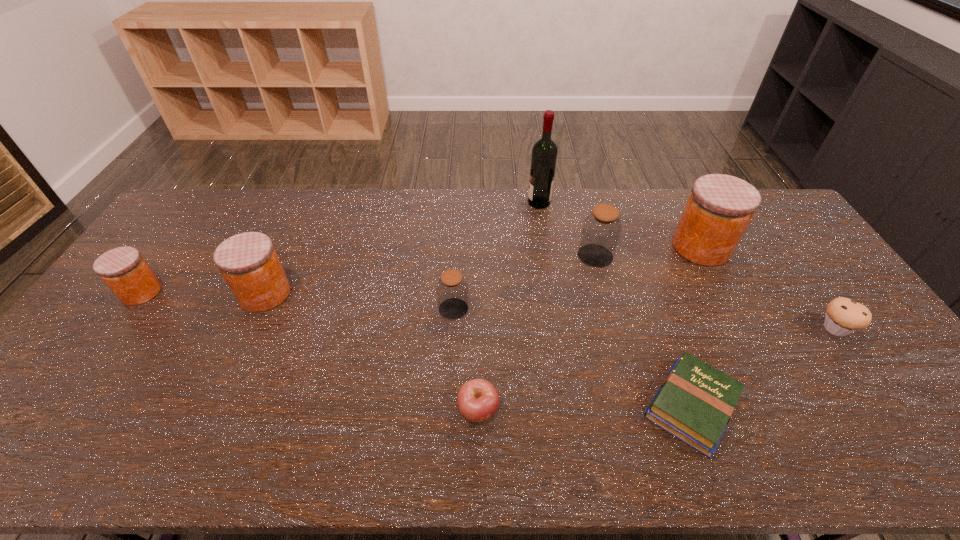
At what (x,y) coordinates should I click in order to perform the action: click on book that is at the near edge. Please return your answer as a coordinate pair (x, y). This screenshot has height=540, width=960. Looking at the image, I should click on (695, 402).

Identify the location of object located at the left edge. This screenshot has height=540, width=960. (123, 269).

Where is `object located in the right edge section of the desktop`? This screenshot has width=960, height=540. object located in the right edge section of the desktop is located at coordinates [844, 316].

Where is `vacant space at the far edge`? vacant space at the far edge is located at coordinates (274, 195).

At what (x,y) coordinates should I click in order to perform the action: click on vacant space at the near edge of the desktop. Please return your answer as a coordinate pair (x, y). Image resolution: width=960 pixels, height=540 pixels. Looking at the image, I should click on pos(165,455).

You are a GUI agent. You are given a task and a screenshot of the screen. Output one action in this format:
    pyautogui.click(x=<x>, y=<y>)
    Task: Click on the free space at the left edge
    The width and height of the screenshot is (960, 540).
    Given the screenshot: What is the action you would take?
    pyautogui.click(x=185, y=240)

Locate an element on the screen. This screenshot has width=960, height=540. free space between the muffin and the left brown jar is located at coordinates (644, 319).

What are the coordinates of `free space that is in between the rightmost object and the fifth object from right to left` in the screenshot? It's located at click(687, 265).

You are a GUI agent. You are given a task and a screenshot of the screen. Output one action in this format:
    pyautogui.click(x=<x>, y=<y>)
    Task: Click on the free area in between the nearer brown jar and the tallest object
    Image resolution: width=960 pixels, height=540 pixels.
    Given the screenshot: What is the action you would take?
    pyautogui.click(x=496, y=255)

The image size is (960, 540). In order to click on free space that is in between the rightmost object and the second jar from left to right in this screenshot , I will do `click(550, 311)`.